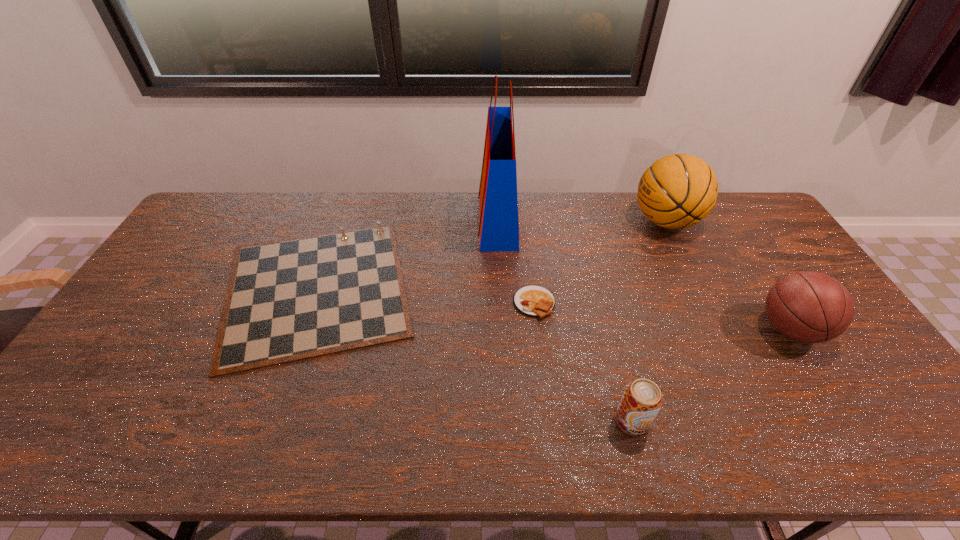
At what (x,y) coordinates should I click in order to perform the action: click on shopping bag that is at the far edge. Please return your answer as a coordinate pair (x, y). The width and height of the screenshot is (960, 540). Looking at the image, I should click on (498, 213).

Where is `basketball present at the far edge`? The width and height of the screenshot is (960, 540). basketball present at the far edge is located at coordinates (677, 191).

Identify the location of gameboard that is at the far edge. pos(291,299).

This screenshot has height=540, width=960. I want to click on object present at the near edge, so click(641, 401).

What are the coordinates of `object that is at the right edge` in the screenshot? It's located at (810, 307).

Identify the location of vacant space at the far edge. Image resolution: width=960 pixels, height=540 pixels. (630, 207).

Identify the location of free space at the near edge. This screenshot has height=540, width=960. (831, 438).

This screenshot has height=540, width=960. In the image, there is a desktop. What are the coordinates of `vacant space at the left edge` in the screenshot? It's located at (180, 309).

The width and height of the screenshot is (960, 540). In order to click on vacant region at the right edge in this screenshot , I will do `click(815, 361)`.

Where is `free space between the shorter basketball and the tallest object`? free space between the shorter basketball and the tallest object is located at coordinates (644, 275).